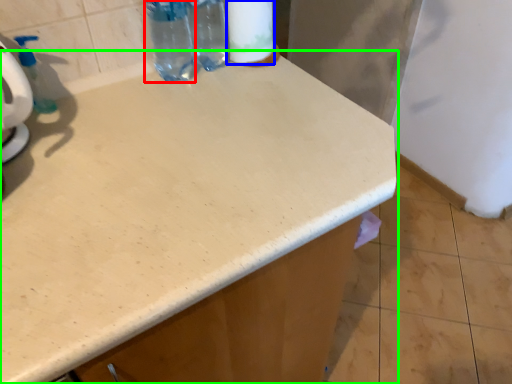
Question: Estimate the real-world distances between objects in this image. Which object is closer to bottle (highlighted by a red box), toilet paper (highlighted by a blue box) or countertop (highlighted by a green box)?

Choices:
 (A) toilet paper
 (B) countertop

Answer: (A)